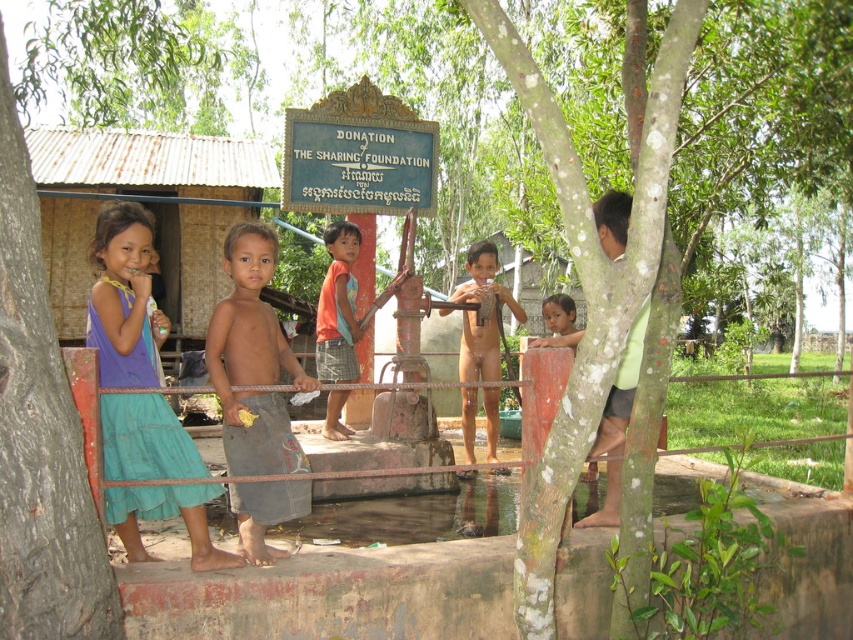
Is orange fabric shirt at center wider than light brown skin at upper center?

In fact, orange fabric shirt at center might be narrower than light brown skin at upper center.

Does orange fabric shirt at center have a lesser height compared to light brown skin at upper center?

Incorrect, orange fabric shirt at center's height does not fall short of light brown skin at upper center's.

You are a GUI agent. You are given a task and a screenshot of the screen. Output one action in this format:
    pyautogui.click(x=<x>, y=<y>)
    Task: Click on the orange fabric shirt at center
    
    Given the screenshot: What is the action you would take?
    pyautogui.click(x=338, y=307)

Does blue cotton dress at left appear under orange fabric shirt at center?

Yes.

What do you see at coordinates (125, 298) in the screenshot? I see `blue cotton dress at left` at bounding box center [125, 298].

Between point (155, 429) and point (354, 356), which one is positioned in front?

Point (155, 429) is in front.

Where is `blue cotton dress at left`? This screenshot has width=853, height=640. blue cotton dress at left is located at coordinates pos(125,298).

Based on the photo, which is more to the left, green rough bark tree at left or gray fabric shorts at center?

green rough bark tree at left is more to the left.

Which of these two, green rough bark tree at left or gray fabric shorts at center, stands shorter?

gray fabric shorts at center

Locate an element on the screen. This screenshot has height=640, width=853. green rough bark tree at left is located at coordinates (39, 435).